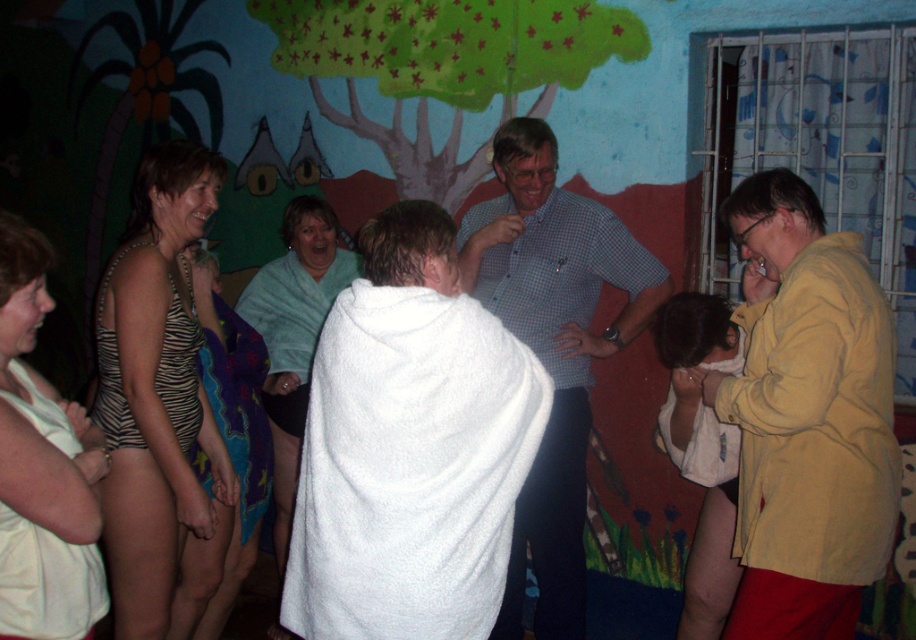
Which is above, checkered fabric shirt at center or teal towel at center?

Positioned higher is checkered fabric shirt at center.

Is point (520, 250) farther from viewer compared to point (252, 301)?

No, it is in front of (252, 301).

Between point (543, 296) and point (317, 298), which one is positioned behind?

Point (317, 298)

I want to click on checkered fabric shirt at center, so click(x=552, y=348).

In the scene shown: Is checkered fabric shirt at center smaller than zebra print swimsuit at left?

Incorrect, checkered fabric shirt at center is not smaller in size than zebra print swimsuit at left.

Does checkered fabric shirt at center appear over zebra print swimsuit at left?

Incorrect, checkered fabric shirt at center is not positioned above zebra print swimsuit at left.

Who is more distant from viewer, (542, 584) or (150, 452)?

Point (542, 584)

The width and height of the screenshot is (916, 640). I want to click on checkered fabric shirt at center, so click(x=552, y=348).

Is white fabric at left thinner than teal towel at center?

Correct, white fabric at left's width is less than teal towel at center's.

Between white fabric at left and teal towel at center, which one is positioned higher?

white fabric at left is above.

Consider the image. Who is more distant from viewer, (x=15, y=348) or (x=335, y=289)?

Positioned behind is point (x=335, y=289).

The height and width of the screenshot is (640, 916). I want to click on white fabric at left, so click(x=42, y=472).